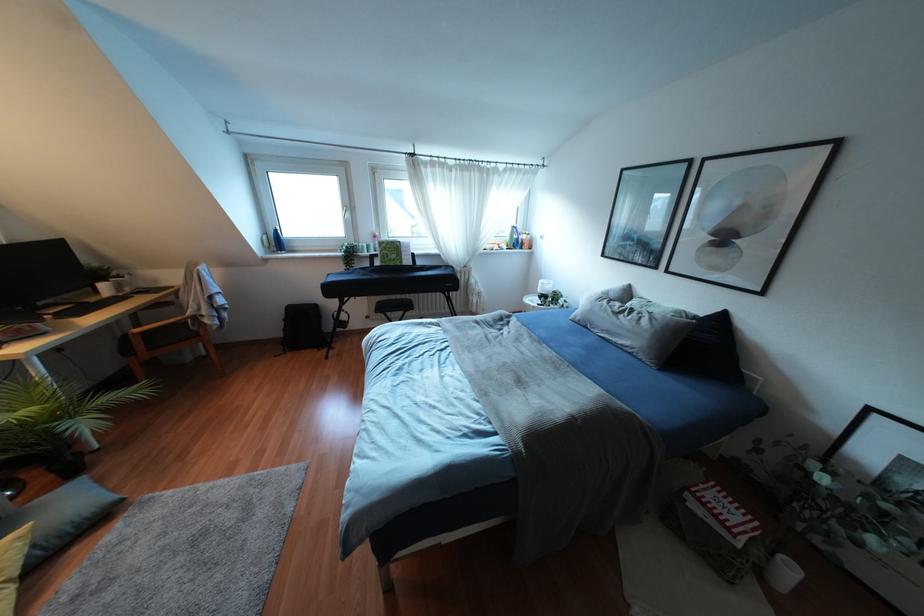
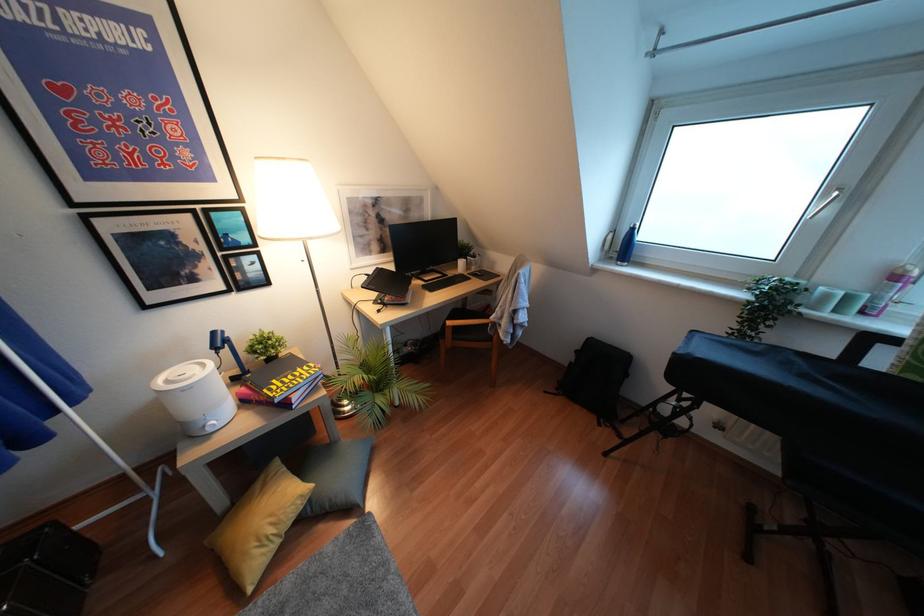
Where in the second image is the point corresponding to point 367,246 from the first image?

(846, 298)